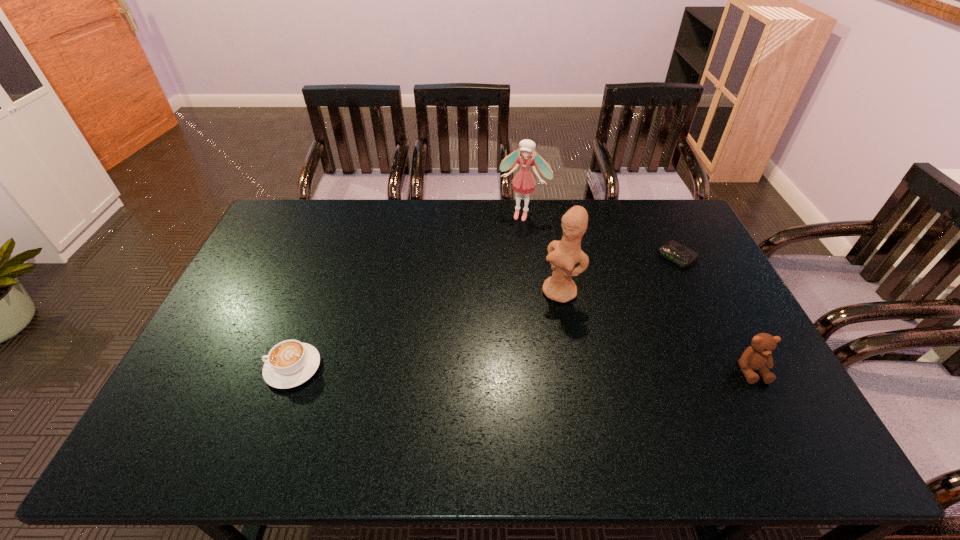
You are a GUI agent. You are given a task and a screenshot of the screen. Output one action in this format:
    pyautogui.click(x=<x>, y=<y>)
    Task: Click on the object at the far edge
    The height and width of the screenshot is (540, 960).
    Given the screenshot: What is the action you would take?
    tap(523, 182)

The image size is (960, 540). Find the location of `cappuccino that is at the near edge`. cappuccino that is at the near edge is located at coordinates (290, 363).

Identify the location of teddy bear that is at the near edge. This screenshot has height=540, width=960. (757, 357).

At what (x,y) coordinates should I click in order to perform the action: click on teddy bear that is at the right edge. Please return your answer as a coordinate pair (x, y). This screenshot has height=540, width=960. Looking at the image, I should click on (757, 357).

Where is `alarm clock located at the right edge`? alarm clock located at the right edge is located at coordinates (682, 256).

Find the location of `object at the near right corner`. object at the near right corner is located at coordinates (757, 357).

Find the location of a particular element. vacant space at the far edge of the desktop is located at coordinates (397, 225).

In the image, there is a desktop. Where is `blank space at the near edge`? The height and width of the screenshot is (540, 960). blank space at the near edge is located at coordinates (546, 407).

In order to click on blank area at the left edge in this screenshot , I will do `click(214, 344)`.

This screenshot has height=540, width=960. In the image, there is a desktop. In order to click on free region at the right edge in this screenshot , I will do `click(706, 272)`.